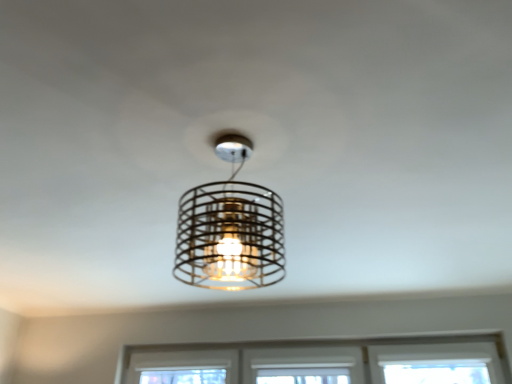
Question: Considering the positions of metallic wire cage at center and clear glass window at center in the image, is metallic wire cage at center wider or thinner than clear glass window at center?

Choices:
 (A) thin
 (B) wide

Answer: (B)

Question: Is point (214, 274) closer or farther from the camera than point (476, 344)?

Choices:
 (A) closer
 (B) farther

Answer: (A)

Question: Which is correct: metallic wire cage at center is inside clear glass window at center, or outside of it?

Choices:
 (A) outside
 (B) inside

Answer: (A)

Question: From the image's perspective, relative to metallic wire cage at center, is clear glass window at center above or below?

Choices:
 (A) below
 (B) above

Answer: (A)

Question: Considering the relative positions of clear glass window at center and metallic wire cage at center in the image provided, is clear glass window at center to the left or to the right of metallic wire cage at center?

Choices:
 (A) left
 (B) right

Answer: (B)

Question: Is point (155, 364) closer or farther from the camera than point (244, 254)?

Choices:
 (A) farther
 (B) closer

Answer: (A)

Question: Is clear glass window at center spatially inside metallic wire cage at center, or outside of it?

Choices:
 (A) inside
 (B) outside

Answer: (B)